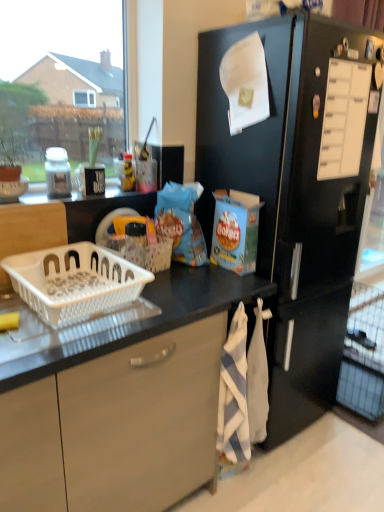
Question: Can you confirm if white plastic basket at center, acting as the 2th basket starting from the front, is positioned to the left of white matte jar at left?

Choices:
 (A) yes
 (B) no

Answer: (B)

Question: From a real-world perspective, is white plastic basket at center, acting as the 2th basket starting from the front, beneath white matte jar at left?

Choices:
 (A) no
 (B) yes

Answer: (B)

Question: Are white plastic basket at center, which is counted as the 1th basket, starting from the back, and white matte jar at left beside each other?

Choices:
 (A) yes
 (B) no

Answer: (B)

Question: Is white plastic basket at center, which is counted as the 1th basket, starting from the back, completely or partially outside of white matte jar at left?

Choices:
 (A) no
 (B) yes

Answer: (B)

Question: Could you tell me if white plastic basket at center, which is counted as the 1th basket, starting from the back, is facing white matte jar at left?

Choices:
 (A) yes
 (B) no

Answer: (B)

Question: Is white plastic basket at center, acting as the 2th basket starting from the front, wider than white matte jar at left?

Choices:
 (A) no
 (B) yes

Answer: (B)

Question: Is black matte refrigerator at right further to camera compared to white plastic drawer at upper right?

Choices:
 (A) no
 (B) yes

Answer: (A)

Question: Does black matte refrigerator at right turn towards white plastic drawer at upper right?

Choices:
 (A) no
 (B) yes

Answer: (B)

Question: Can you confirm if black matte refrigerator at right is shorter than white plastic drawer at upper right?

Choices:
 (A) yes
 (B) no

Answer: (B)

Question: Are black matte refrigerator at right and white plastic drawer at upper right beside each other?

Choices:
 (A) no
 (B) yes

Answer: (A)

Question: Can you confirm if black matte refrigerator at right is positioned to the left of white plastic drawer at upper right?

Choices:
 (A) no
 (B) yes

Answer: (B)

Question: Is black matte refrigerator at right not near white plastic drawer at upper right?

Choices:
 (A) yes
 (B) no

Answer: (B)

Question: Can you confirm if white plastic basket at lower left, which ranks as the first basket in front-to-back order, is wider than black matte refrigerator at right?

Choices:
 (A) yes
 (B) no

Answer: (B)